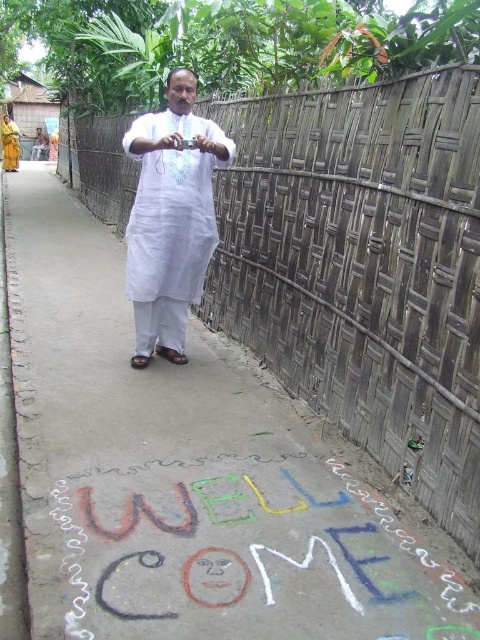
You are standing on the pathway and want to walk towards the man. Which point, point (x=180, y=177) or point (x=7, y=163), is closer to you as you move forward?

Point (x=180, y=177) is closer to the viewer than point (x=7, y=163), so you would encounter point (x=180, y=177) first as you move forward towards the man.

You are a photographer positioned at the camera location. You want to capture both the man and the bamboo fence in your shot. Which of the two points, point (394, 264) or point (170, 262), is closer to your camera position?

Point (394, 264) is closer to the camera than point (170, 262), so it will appear larger in the photograph.